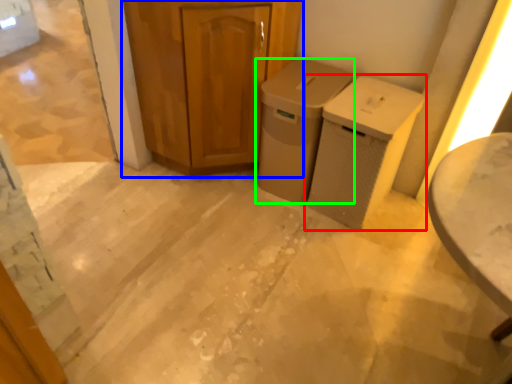
Question: Considering the real-world distances, which object is farthest from waste container (highlighted by a red box)? cabinetry (highlighted by a blue box) or waste container (highlighted by a green box)?

Choices:
 (A) cabinetry
 (B) waste container

Answer: (A)